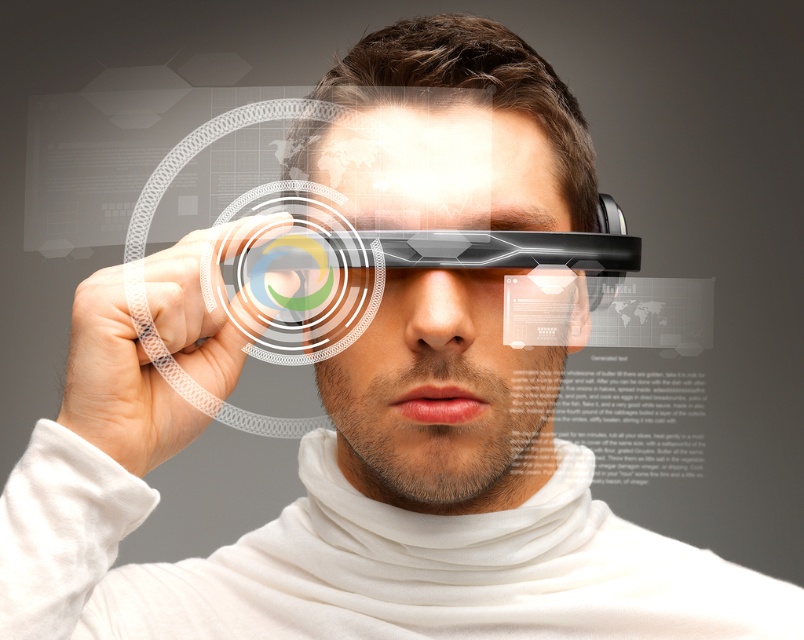
Who is taller, transparent plastic face at center or translucent plastic hand at center?

transparent plastic face at center

Who is higher up, transparent plastic face at center or translucent plastic hand at center?

transparent plastic face at center is higher up.

Between point (343, 449) and point (201, 381), which one is positioned behind?

The point (343, 449) is behind.

At what (x,y) coordinates should I click in order to perform the action: click on transparent plastic face at center. Please return your answer as a coordinate pair (x, y). Looking at the image, I should click on (442, 397).